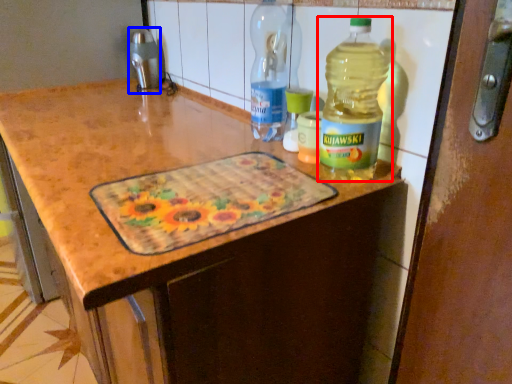
Question: Which of the following is the closest to the observer, bottle (highlighted by a red box) or appliance (highlighted by a blue box)?

Choices:
 (A) bottle
 (B) appliance

Answer: (A)